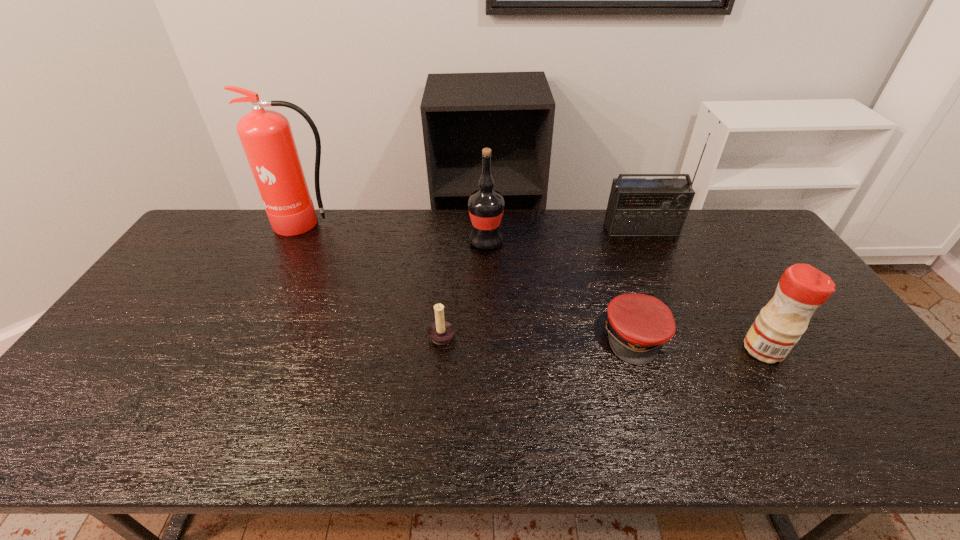
Point out which object is positioned as the fourth nearest to the fourth tallest object. Please provide its 2D coordinates. Your answer should be formatted as a tuple, i.e. [(x, y)], where the tuple contains the x and y coordinates of a point satisfying the conditions above.

[(440, 332)]

You are a GUI agent. You are given a task and a screenshot of the screen. Output one action in this format:
    pyautogui.click(x=<x>, y=<y>)
    Task: Click on the free location that satisfies the following two spatial constraints: 1. on the front panel of the radio receiver; 2. on the right side of the fourth tallest object
    The width and height of the screenshot is (960, 540).
    Given the screenshot: What is the action you would take?
    [x=697, y=349]

Image resolution: width=960 pixels, height=540 pixels. I want to click on vacant space that satisfies the following two spatial constraints: 1. on the back side of the condiment; 2. on the wick of the candle holder, so click(755, 334).

I want to click on vacant point that satisfies the following two spatial constraints: 1. towards the nozzle of the wine bottle; 2. on the right side of the fire extinguisher, so click(x=299, y=242).

Where is `free location that satisfies the following two spatial constraints: 1. towards the nozzle of the leftmost object; 2. on the right side of the fourth tallest object`? free location that satisfies the following two spatial constraints: 1. towards the nozzle of the leftmost object; 2. on the right side of the fourth tallest object is located at coordinates (245, 349).

Image resolution: width=960 pixels, height=540 pixels. Identify the location of free space that satisfies the following two spatial constraints: 1. towards the nozzle of the fire extinguisher; 2. on the left side of the fourth tallest object. (245, 349).

What are the coordinates of `free space that satisfies the following two spatial constraints: 1. on the front of the cap with an emblem; 2. on the left side of the third shortest object` in the screenshot? It's located at (639, 349).

At what (x,y) coordinates should I click in order to perform the action: click on free space that satisfies the following two spatial constraints: 1. towards the nozzle of the wine bottle; 2. on the left side of the leftmost object. Please return your answer as a coordinate pair (x, y). Looking at the image, I should click on (299, 242).